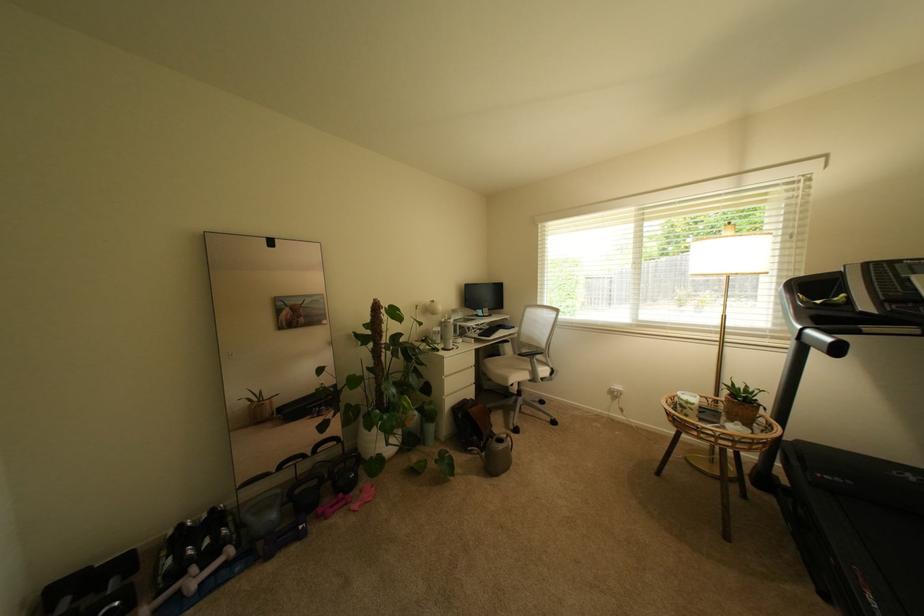
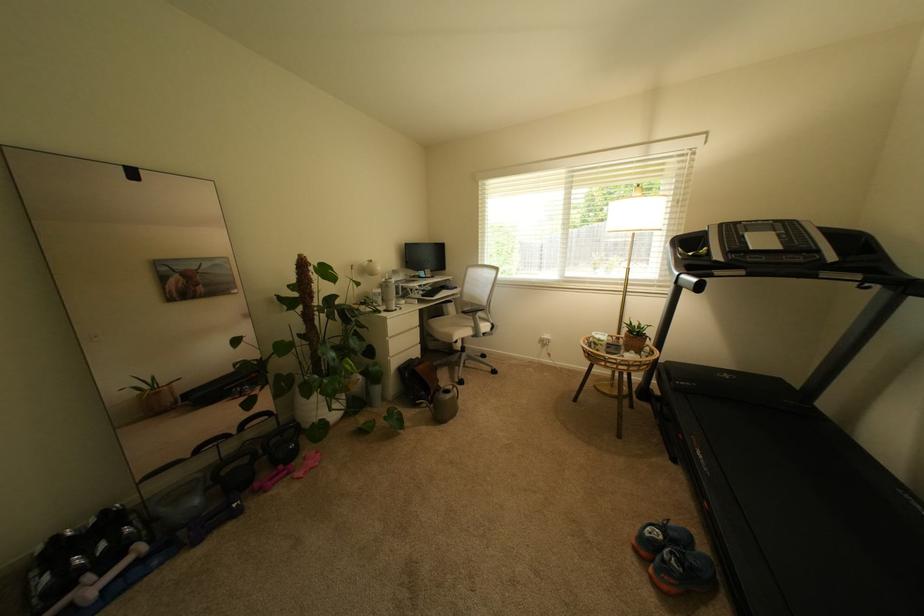
Where in the second image is the point corresponding to the point at 515,379 from the first image?

(459, 338)